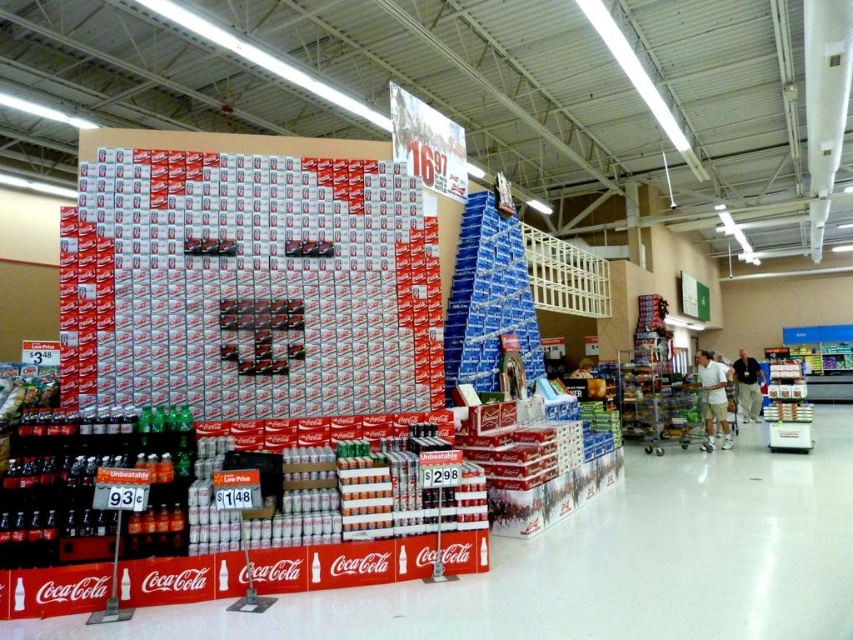
What do you see at coordinates (712, 397) in the screenshot? I see `white cotton t-shirt at center` at bounding box center [712, 397].

Is point (709, 426) farther from camera compared to point (751, 410)?

No, it is not.

The width and height of the screenshot is (853, 640). In order to click on white cotton t-shirt at center in this screenshot , I will do `click(712, 397)`.

Which is behind, point (666, 440) or point (697, 380)?

Positioned behind is point (697, 380).

Is metallic silver shopping cart at center-right below white cotton t-shirt at center?

Correct, metallic silver shopping cart at center-right is located below white cotton t-shirt at center.

Where is `metallic silver shopping cart at center-right`? metallic silver shopping cart at center-right is located at coordinates (668, 416).

Between point (660, 385) and point (758, 381), which one is positioned behind?

The point (758, 381) is more distant.

Is metallic silver shopping cart at center-right shorter than tan fabric pants at lower right?

Incorrect, metallic silver shopping cart at center-right's height does not fall short of tan fabric pants at lower right's.

Is point (677, 428) behind point (747, 403)?

No, (677, 428) is in front of (747, 403).

Locate an element on the screen. The height and width of the screenshot is (640, 853). metallic silver shopping cart at center-right is located at coordinates (668, 416).